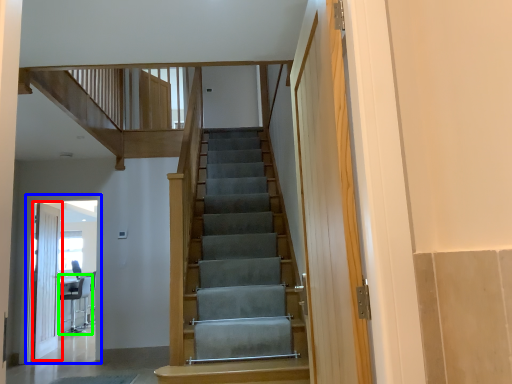
Question: Which is nearer to the door (highlighted by a red box)? elevator (highlighted by a blue box) or chair (highlighted by a green box).

Choices:
 (A) elevator
 (B) chair

Answer: (A)